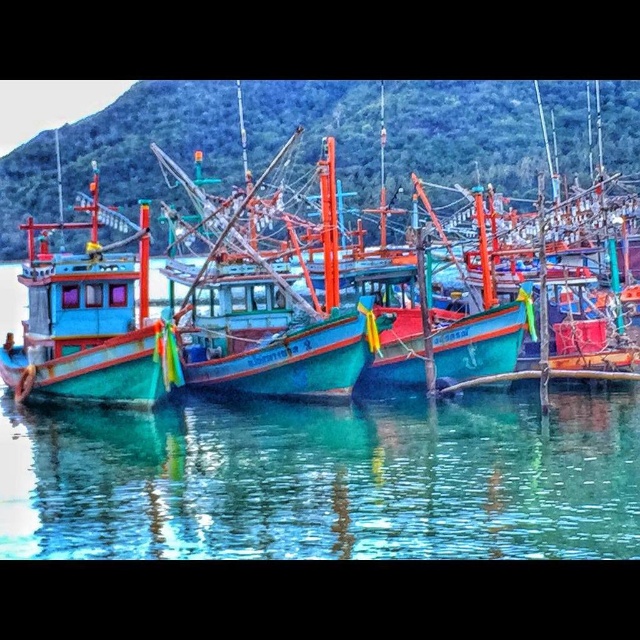
Is transparent water at center positioned before teal wooden boat at center?

Yes, it is.

Can you confirm if transparent water at center is positioned to the left of teal wooden boat at center?

In fact, transparent water at center is to the right of teal wooden boat at center.

Find the location of a particular element. The width and height of the screenshot is (640, 640). transparent water at center is located at coordinates (323, 481).

Is teal wooden boat at center below teal glossy boat at left?

Incorrect, teal wooden boat at center is not positioned below teal glossy boat at left.

Does teal wooden boat at center have a greater height compared to teal glossy boat at left?

Yes.

Is point (134, 196) in front of point (104, 273)?

No, it is behind (104, 273).

Find the location of a particular element. This screenshot has width=640, height=640. teal wooden boat at center is located at coordinates (464, 132).

Who is positioned more to the left, transparent water at center or teal glossy boat at left?

teal glossy boat at left

How distant is transparent water at center from teal glossy boat at left?

46.77 feet

Who is more distant from viewer, (449, 556) or (42, 224)?

Point (42, 224)

At what (x,y) coordinates should I click in order to perform the action: click on transparent water at center. Please return your answer as a coordinate pair (x, y). Looking at the image, I should click on (323, 481).